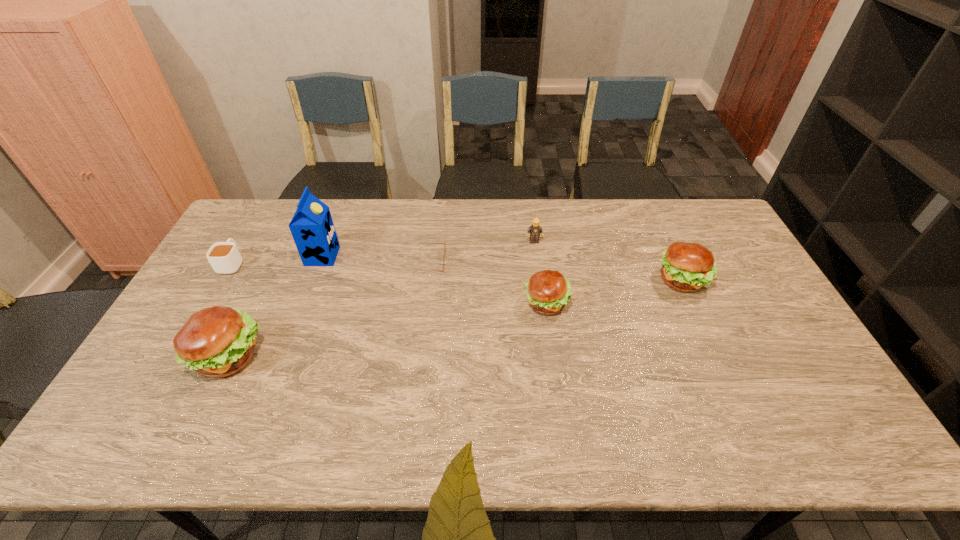
Identify the location of blank space that satisfies the following two spatial constraints: 1. on the face of the fourth object from left to right; 2. on the right side of the fifth shortest object. (427, 280).

Where is `free space that satisfies the following two spatial constraints: 1. in front of the farthest object; 2. on the left side of the second hamburger from right to left`? The width and height of the screenshot is (960, 540). free space that satisfies the following two spatial constraints: 1. in front of the farthest object; 2. on the left side of the second hamburger from right to left is located at coordinates (542, 303).